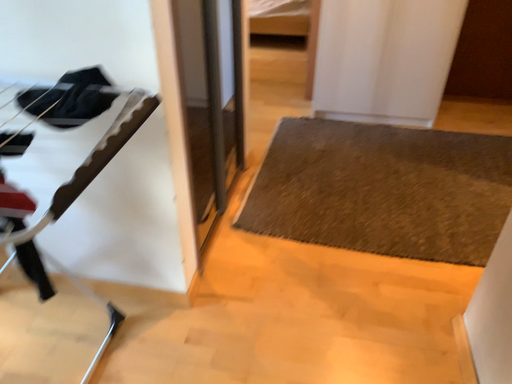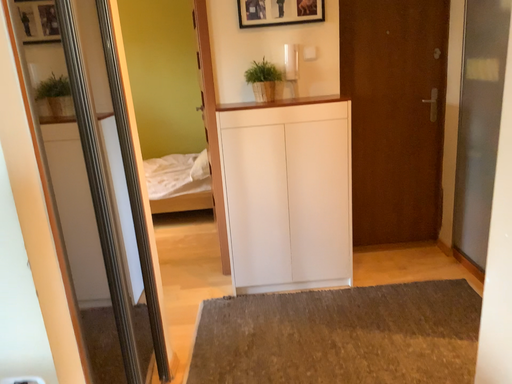
Question: Which way did the camera rotate in the video?

Choices:
 (A) rotated upward
 (B) rotated downward

Answer: (A)